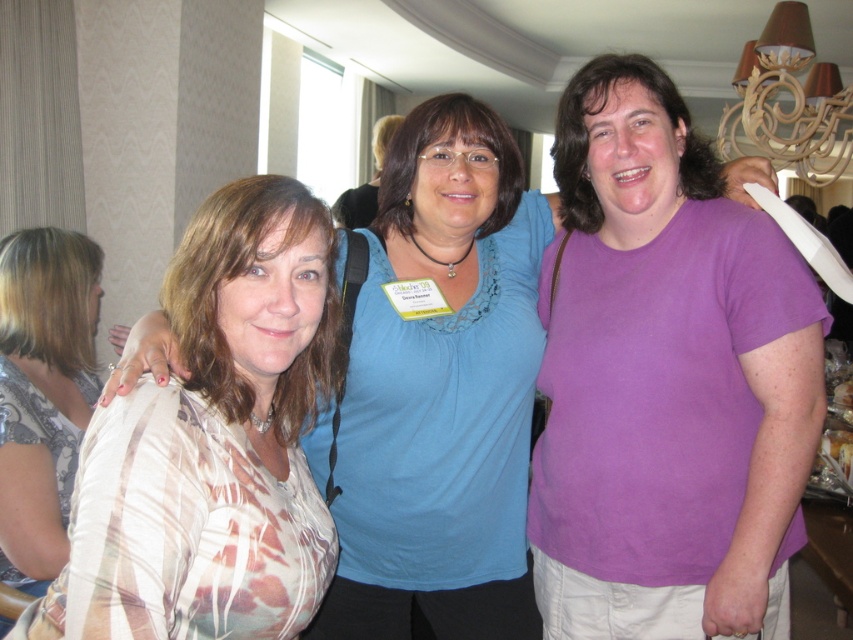
Question: Estimate the real-world distances between objects in this image. Which object is closer to the plaid fabric shirt at left?

Choices:
 (A) purple matte shirt at center
 (B) plaid fabric shirt at center
 (C) printed fabric blouse at center

Answer: (B)

Question: Which object is closer to the camera taking this photo?

Choices:
 (A) plaid fabric shirt at left
 (B) printed fabric blouse at center

Answer: (B)

Question: Is purple matte shirt at center wider than plaid fabric shirt at left?

Choices:
 (A) no
 (B) yes

Answer: (B)

Question: Is printed fabric blouse at center behind plaid fabric shirt at center?

Choices:
 (A) yes
 (B) no

Answer: (B)

Question: Is printed fabric blouse at center below plaid fabric shirt at center?

Choices:
 (A) no
 (B) yes

Answer: (B)

Question: Considering the real-world distances, which object is closest to the plaid fabric shirt at left?

Choices:
 (A) printed fabric blouse at center
 (B) purple matte shirt at center

Answer: (A)